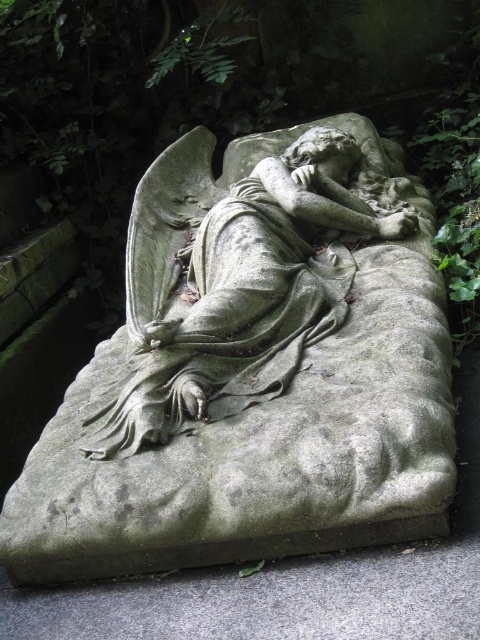
Question: Among these objects, which one is farthest from the camera?

Choices:
 (A) gray stone angel at center
 (B) gray stone bench at lower center

Answer: (A)

Question: Does gray stone angel at center have a smaller size compared to gray stone bench at lower center?

Choices:
 (A) no
 (B) yes

Answer: (A)

Question: Is gray stone angel at center positioned behind gray stone bench at lower center?

Choices:
 (A) yes
 (B) no

Answer: (A)

Question: Is gray stone angel at center in front of gray stone bench at lower center?

Choices:
 (A) yes
 (B) no

Answer: (B)

Question: Which of the following is the closest to the observer?

Choices:
 (A) 156,593
 (B) 186,138

Answer: (A)